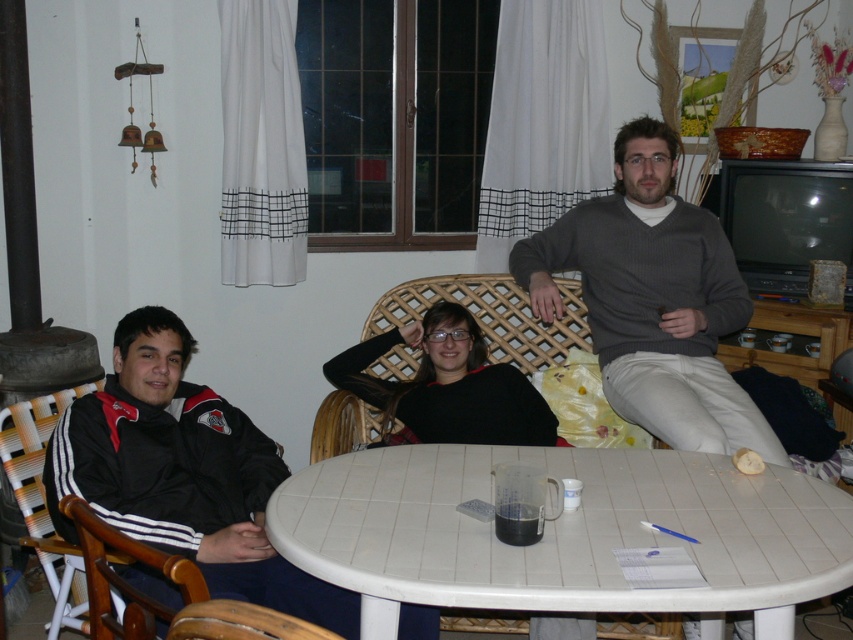
Does black fabric jacket at left appear under gray sweater at center?

Yes.

Is black fabric jacket at left bigger than gray sweater at center?

No.

Find the location of a particular element. The width and height of the screenshot is (853, 640). black fabric jacket at left is located at coordinates (183, 474).

The height and width of the screenshot is (640, 853). What do you see at coordinates (561, 532) in the screenshot?
I see `white tile table at center` at bounding box center [561, 532].

Which is more to the right, white tile table at center or black sweater at center?

white tile table at center is more to the right.

You are a GUI agent. You are given a task and a screenshot of the screen. Output one action in this format:
    pyautogui.click(x=<x>, y=<y>)
    Task: Click on the white tile table at center
    
    Given the screenshot: What is the action you would take?
    pyautogui.click(x=561, y=532)

Is the position of white tile table at center more distant than that of gray sweater at center?

No, it is not.

Is white tile table at center to the left of gray sweater at center from the viewer's perspective?

Indeed, white tile table at center is positioned on the left side of gray sweater at center.

Does point (791, 624) lie in front of point (712, 397)?

Yes.

This screenshot has height=640, width=853. I want to click on white tile table at center, so click(561, 532).